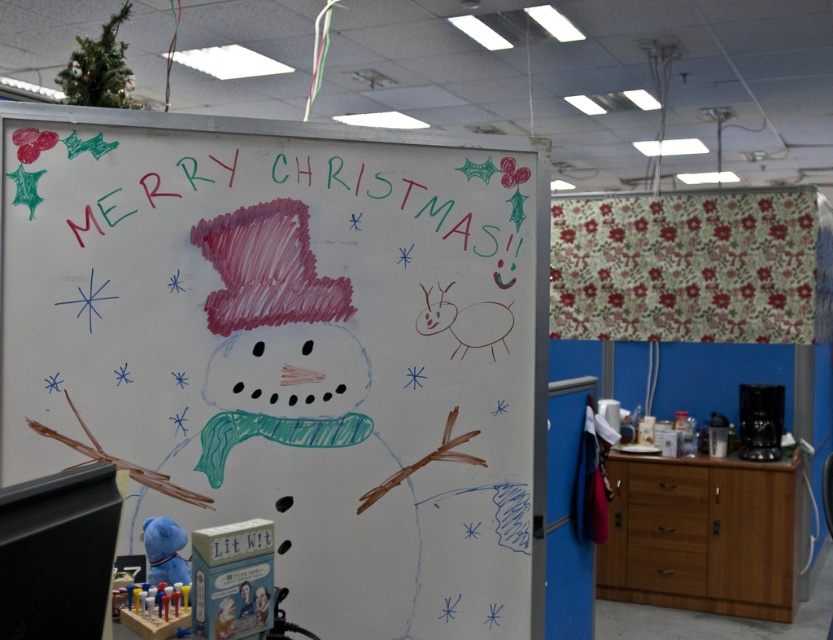
Which is below, white chalkboard at center or blue plush toy at lower left?

Positioned lower is blue plush toy at lower left.

Does white chalkboard at center appear under blue plush toy at lower left?

Incorrect, white chalkboard at center is not positioned below blue plush toy at lower left.

What do you see at coordinates (292, 348) in the screenshot? The width and height of the screenshot is (833, 640). I see `white chalkboard at center` at bounding box center [292, 348].

This screenshot has height=640, width=833. I want to click on white chalkboard at center, so click(292, 348).

Can you confirm if colored chalk snowman at center is bigger than blue plush toy at lower left?

Yes.

The height and width of the screenshot is (640, 833). What do you see at coordinates (300, 419) in the screenshot? I see `colored chalk snowman at center` at bounding box center [300, 419].

Between point (203, 456) and point (158, 564), which one is positioned behind?

The point (203, 456) is more distant.

This screenshot has width=833, height=640. Identify the location of colored chalk snowman at center. (300, 419).

Does point (78, 312) come behind point (205, 444)?

No, (78, 312) is in front of (205, 444).

This screenshot has width=833, height=640. What do you see at coordinates (292, 348) in the screenshot? I see `white chalkboard at center` at bounding box center [292, 348].

Is point (429, 321) positioned after point (232, 499)?

Yes, it is behind point (232, 499).

Locate an element on the screen. The image size is (833, 640). white chalkboard at center is located at coordinates (292, 348).